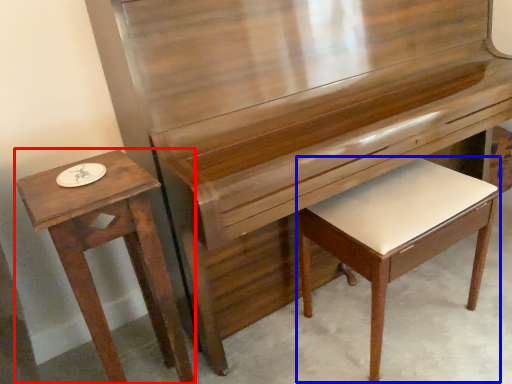
Question: Which of the following is the farthest to the observer, table (highlighted by a red box) or music stool (highlighted by a blue box)?

Choices:
 (A) table
 (B) music stool

Answer: (B)